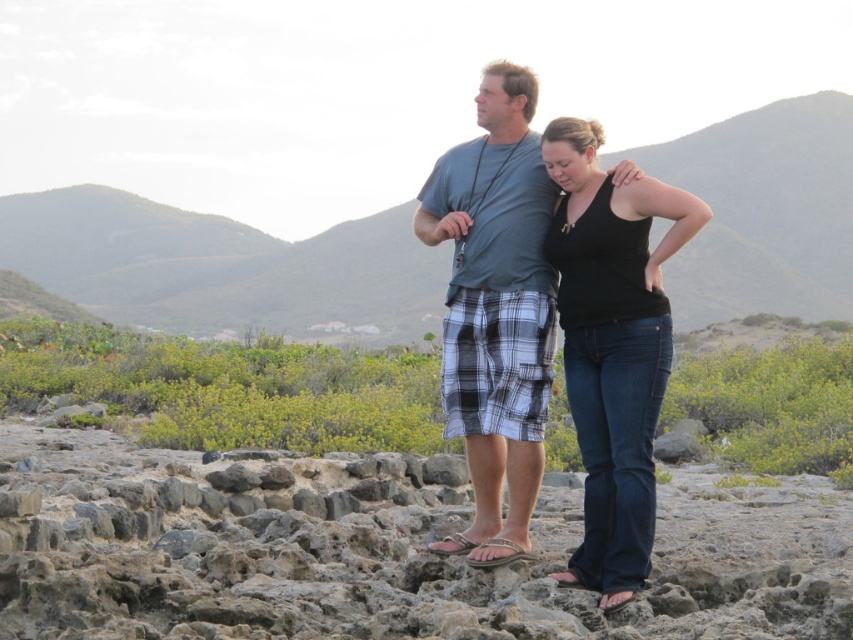
You are a hiker trying to place your gray plaid shorts at center on top of the rusty stone at center. Based on their sizes, will the shorts fit entirely on the stone?

The rusty stone at center might be wider than gray plaid shorts at center, so there is a possibility that the shorts can fit entirely on the stone if the stone is indeed wider. However, the description is uncertain, so it might not be guaranteed.

You are a photographer trying to capture a landscape photo. You have a camera around your neck and are standing near the black denim jeans at center. Can you see the green grassy hill at upper center clearly in your shot?

The green grassy hill at upper center is bigger than the black denim jeans at center, so yes, you can see it clearly in your shot.

You are a photographer positioned at the left edge of the image. You want to capture a photo of the rusty stone at center without including the two people in the frame. Based on their positions, can you determine if you can achieve this by moving only your camera horizontally? Please explain your reasoning.

The rusty stone at center is located at point (381, 552). Since you are at the left edge, moving the camera horizontally might allow you to frame the stone while avoiding the people if their positions do not block that coordinate. However, without knowing their exact positions relative to the stone, it is uncertain. The question cannot be definitively answered with the given information.